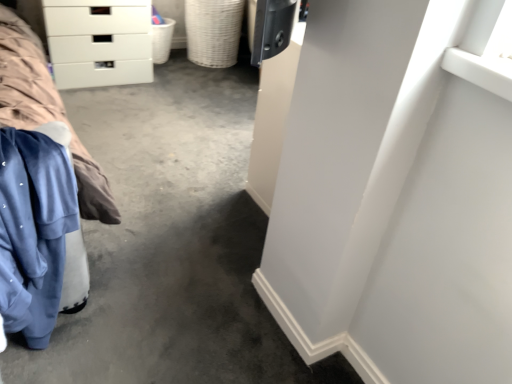
The height and width of the screenshot is (384, 512). I want to click on vacant space underneath blue fleece at left (from a real-world perspective), so click(54, 339).